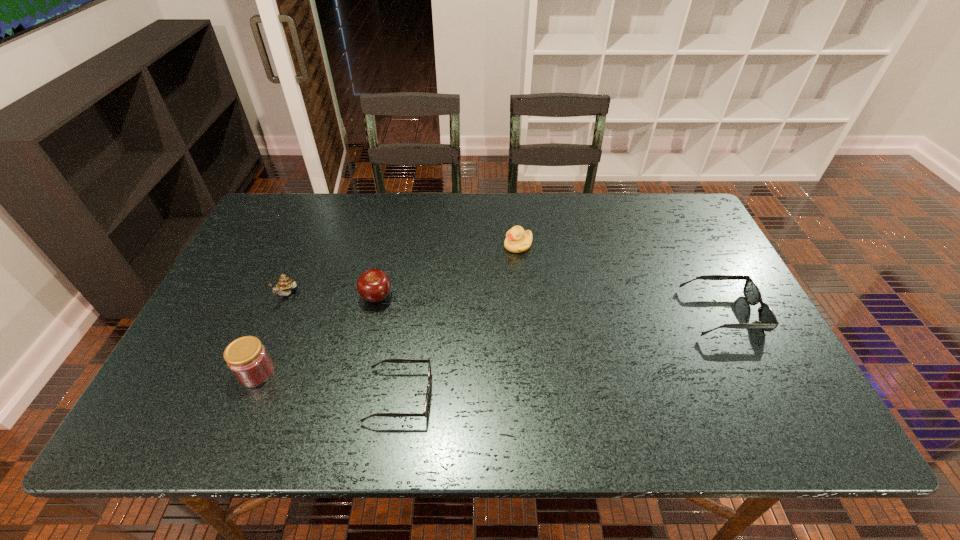
The width and height of the screenshot is (960, 540). Identify the location of the left sunglasses. (427, 400).

Image resolution: width=960 pixels, height=540 pixels. In order to click on the shortest object in this screenshot , I will do `click(427, 400)`.

Image resolution: width=960 pixels, height=540 pixels. What are the coordinates of `the taller sunglasses` in the screenshot? It's located at (767, 319).

Locate an element on the screen. the right sunglasses is located at coordinates (767, 319).

This screenshot has height=540, width=960. Find the location of `apple`. apple is located at coordinates (374, 285).

This screenshot has width=960, height=540. I want to click on snail, so click(x=285, y=284).

Locate an element on the screen. This screenshot has width=960, height=540. the third shortest object is located at coordinates (517, 240).

Identify the location of the second object from right to left. This screenshot has width=960, height=540. (517, 240).

The width and height of the screenshot is (960, 540). I want to click on jam, so click(247, 358).

The image size is (960, 540). Find the location of `vacant area located 0.400m at the front lenses of the left sunglasses`. vacant area located 0.400m at the front lenses of the left sunglasses is located at coordinates (612, 396).